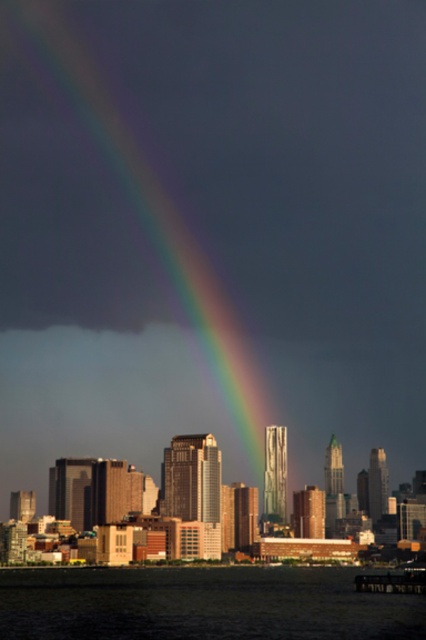
Question: Observing the image, what is the correct spatial positioning of transparent water at lower center in reference to smooth glass skyscraper at center?

Choices:
 (A) left
 (B) right

Answer: (B)

Question: Considering the real-world distances, which object is closest to the transparent water at lower center?

Choices:
 (A) rainbow at center
 (B) smooth glass skyscraper at center

Answer: (B)

Question: Which object is positioned closest to the rainbow at center?

Choices:
 (A) transparent water at lower center
 (B) smooth glass skyscraper at center

Answer: (B)

Question: Based on their relative distances, which object is nearer to the smooth glass skyscraper at center?

Choices:
 (A) transparent water at lower center
 (B) rainbow at center

Answer: (A)

Question: Is transparent water at lower center to the left of smooth glass skyscraper at center from the viewer's perspective?

Choices:
 (A) yes
 (B) no

Answer: (B)

Question: Is rainbow at center positioned in front of transparent water at lower center?

Choices:
 (A) no
 (B) yes

Answer: (B)